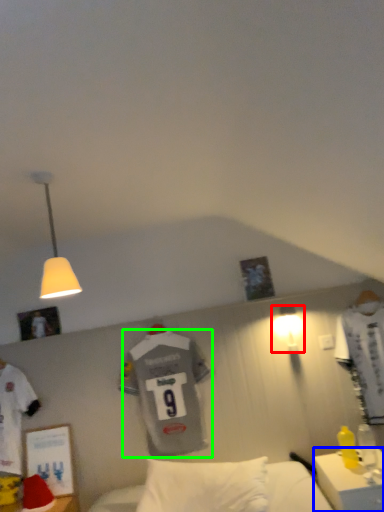
Question: Based on their relative distances, which object is nearer to lamp (highlighted by a red box)? Choose from desk (highlighted by a blue box) and t shirt (highlighted by a green box).

Choices:
 (A) desk
 (B) t shirt

Answer: (B)